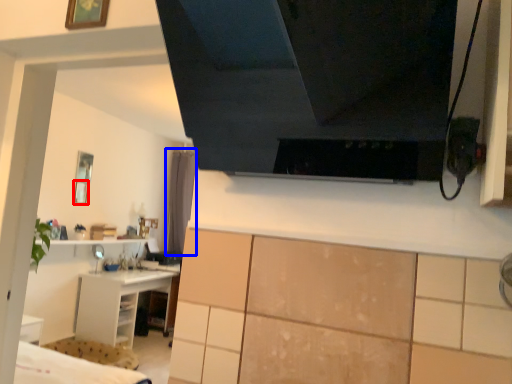
Question: Which object is further to the camera taking this photo, picture frame (highlighted by a red box) or curtain (highlighted by a blue box)?

Choices:
 (A) picture frame
 (B) curtain

Answer: (B)